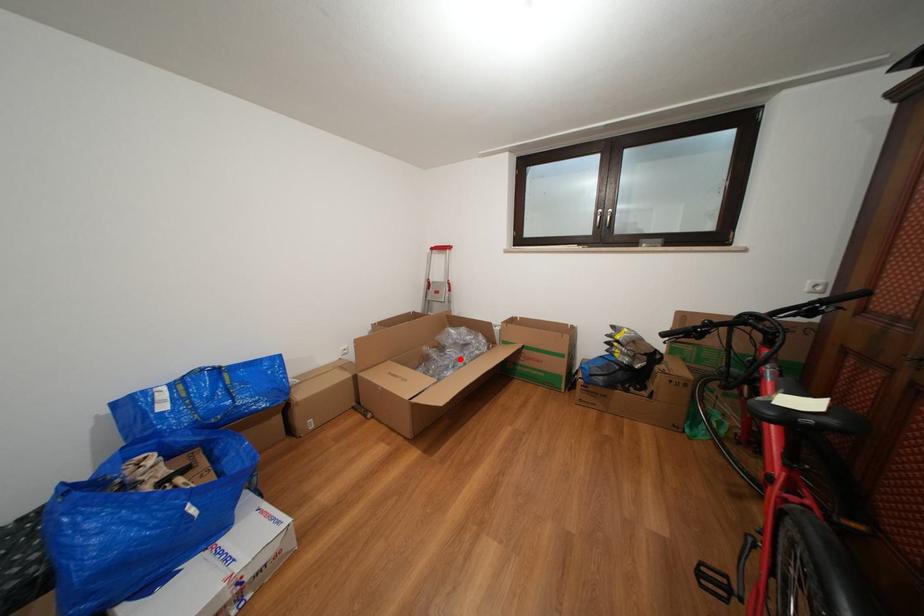
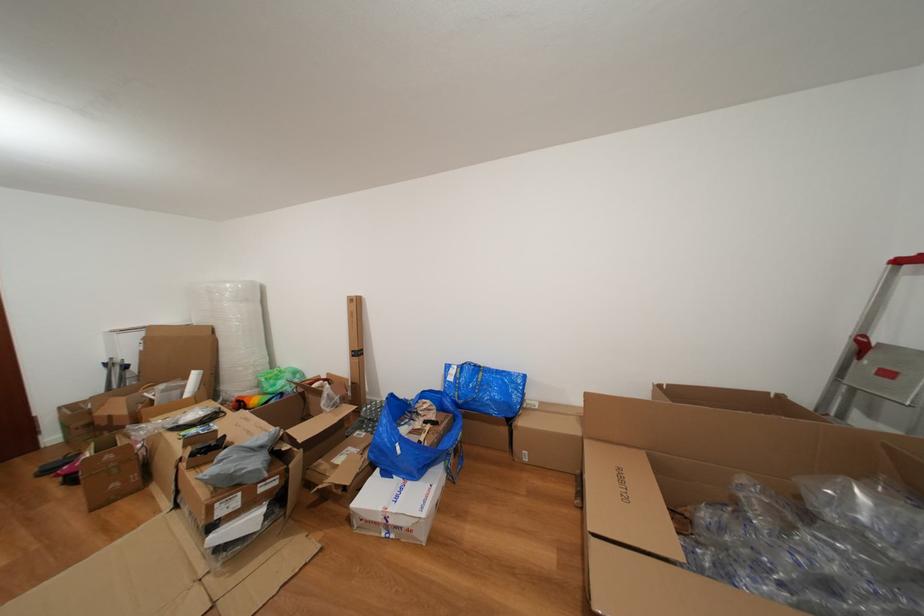
Question: I am providing you with two images of the same scene from different viewpoints. Given a red point in image1, look at the same physical point in image2. Is it:

Choices:
 (A) Closer to the viewpoint
 (B) Farther from the viewpoint

Answer: (A)